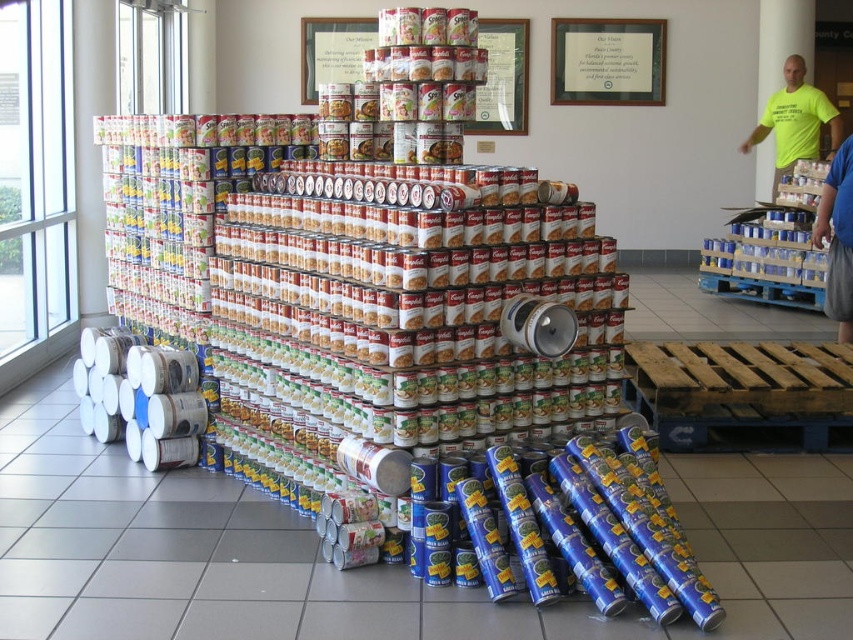
You are standing in the canned goods area and see the point labeled as point (795, 120). What object is located at that point?

The point (795, 120) corresponds to the neon yellow t shirt at upper right.